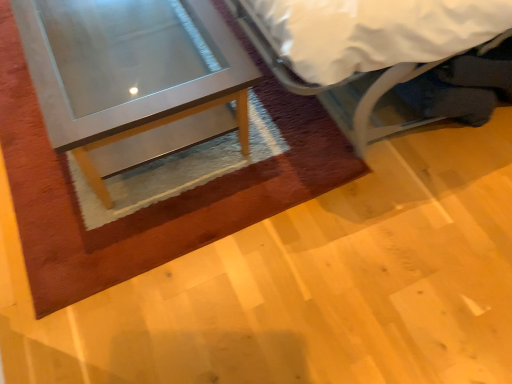
What do you see at coordinates (378, 99) in the screenshot? I see `white fabric bed at upper right` at bounding box center [378, 99].

The height and width of the screenshot is (384, 512). Identify the location of white fabric bed at upper right. (378, 99).

The width and height of the screenshot is (512, 384). Describe the element at coordinates (128, 70) in the screenshot. I see `matte glass table at left` at that location.

Locate an element on the screen. This screenshot has width=512, height=384. matte glass table at left is located at coordinates pyautogui.click(x=128, y=70).

Locate an element on the screen. The height and width of the screenshot is (384, 512). white fabric bed at upper right is located at coordinates (378, 99).

Based on their positions, is white fabric bed at upper right located to the left or right of matte glass table at left?

Clearly, white fabric bed at upper right is on the right of matte glass table at left in the image.

Is white fabric bed at upper right further to camera compared to matte glass table at left?

No, white fabric bed at upper right is closer to the camera.

Between point (309, 89) and point (69, 138), which one is positioned behind?

The point (309, 89) is more distant.

From the image's perspective, which is above, white fabric bed at upper right or matte glass table at left?

white fabric bed at upper right.

From a real-world perspective, is white fabric bed at upper right physically below matte glass table at left?

Actually, white fabric bed at upper right is physically above matte glass table at left in the real world.

Considering the relative sizes of white fabric bed at upper right and matte glass table at left in the image provided, is white fabric bed at upper right wider than matte glass table at left?

Yes, white fabric bed at upper right is wider than matte glass table at left.

Does white fabric bed at upper right have a lesser height compared to matte glass table at left?

No, white fabric bed at upper right is not shorter than matte glass table at left.

Considering the sizes of white fabric bed at upper right and matte glass table at left in the image, is white fabric bed at upper right bigger or smaller than matte glass table at left?

In the image, white fabric bed at upper right appears to be larger than matte glass table at left.

Which is correct: white fabric bed at upper right is inside matte glass table at left, or outside of it?

white fabric bed at upper right lies outside matte glass table at left.

Are white fabric bed at upper right and matte glass table at left located far from each other?

No, white fabric bed at upper right is not far away from matte glass table at left.

Does white fabric bed at upper right turn towards matte glass table at left?

Yes, white fabric bed at upper right is aimed at matte glass table at left.

Locate an element on the screen. bed in front of the matte glass table at left is located at coordinates (378, 99).

Is matte glass table at left at the left side of white fabric bed at upper right?

Indeed, matte glass table at left is positioned on the left side of white fabric bed at upper right.

Considering the positions of objects matte glass table at left and white fabric bed at upper right in the image provided, who is behind, matte glass table at left or white fabric bed at upper right?

matte glass table at left.

Which is behind, point (116, 45) or point (268, 54)?

The point (116, 45) is more distant.

From the image's perspective, is matte glass table at left located above or below white fabric bed at upper right?

Clearly, from the image's perspective, matte glass table at left is below white fabric bed at upper right.

From a real-world perspective, is matte glass table at left above or below white fabric bed at upper right?

matte glass table at left is situated lower than white fabric bed at upper right in the real world.

Does matte glass table at left have a greater width compared to white fabric bed at upper right?

No, matte glass table at left is not wider than white fabric bed at upper right.

Who is shorter, matte glass table at left or white fabric bed at upper right?

With less height is matte glass table at left.

Considering the sizes of matte glass table at left and white fabric bed at upper right in the image, is matte glass table at left bigger or smaller than white fabric bed at upper right?

Clearly, matte glass table at left is smaller in size than white fabric bed at upper right.

Is white fabric bed at upper right surrounded by matte glass table at left?

No.

Is matte glass table at left far away from white fabric bed at upper right?

No, matte glass table at left is not far away from white fabric bed at upper right.

Is matte glass table at left oriented towards white fabric bed at upper right?

No.

Can you tell me how much matte glass table at left and white fabric bed at upper right differ in facing direction?

The angular difference between matte glass table at left and white fabric bed at upper right is 0.532 degrees.

Locate an element on the screen. The width and height of the screenshot is (512, 384). bed above the matte glass table at left (from a real-world perspective) is located at coordinates (378, 99).

In order to click on table behind the white fabric bed at upper right in this screenshot , I will do `click(128, 70)`.

Locate an element on the screen. This screenshot has width=512, height=384. bed above the matte glass table at left (from the image's perspective) is located at coordinates (378, 99).